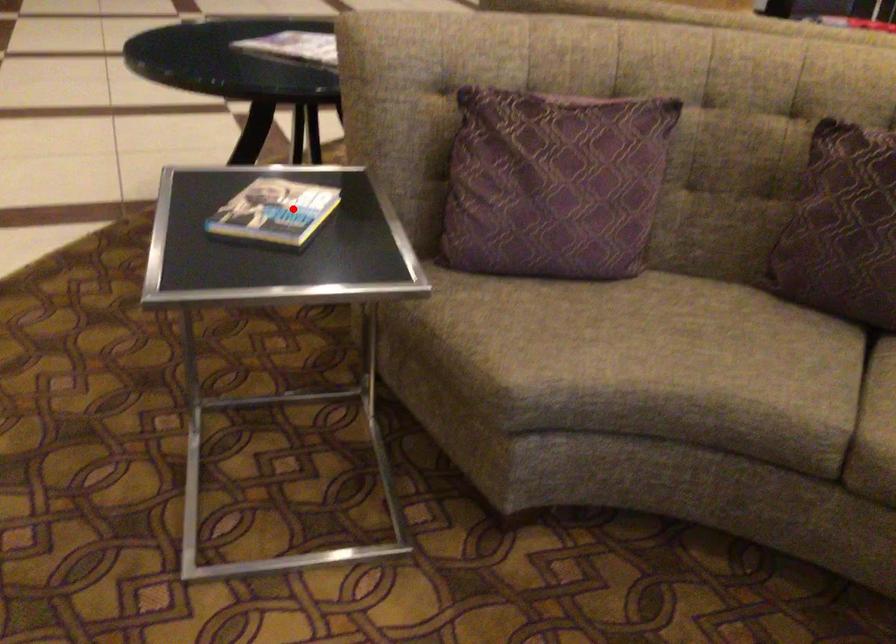
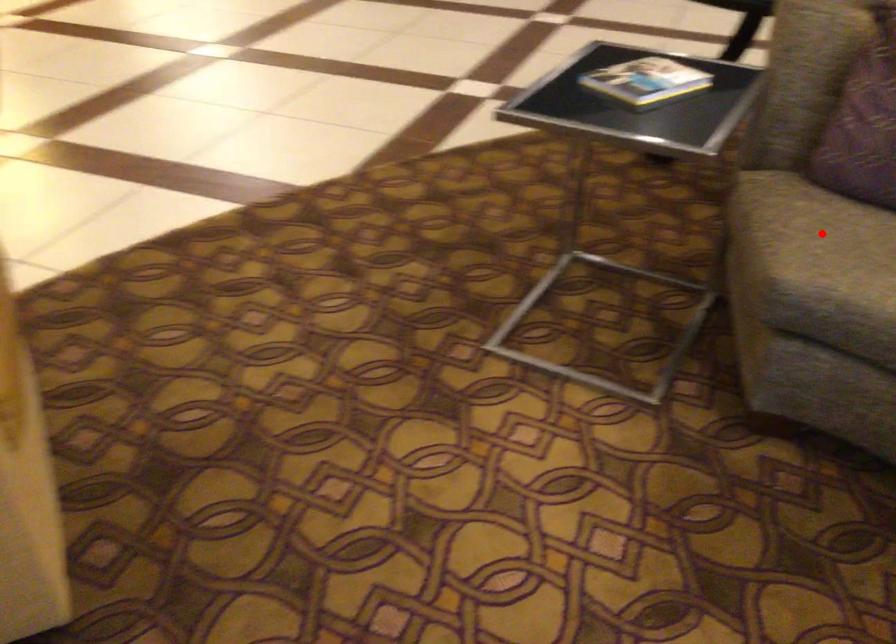
I am providing you with two images of the same scene from different viewpoints. A red point is marked on the first image and another point is marked on the second image. Are the points marked in image1 and image2 representing the same 3D position?

No